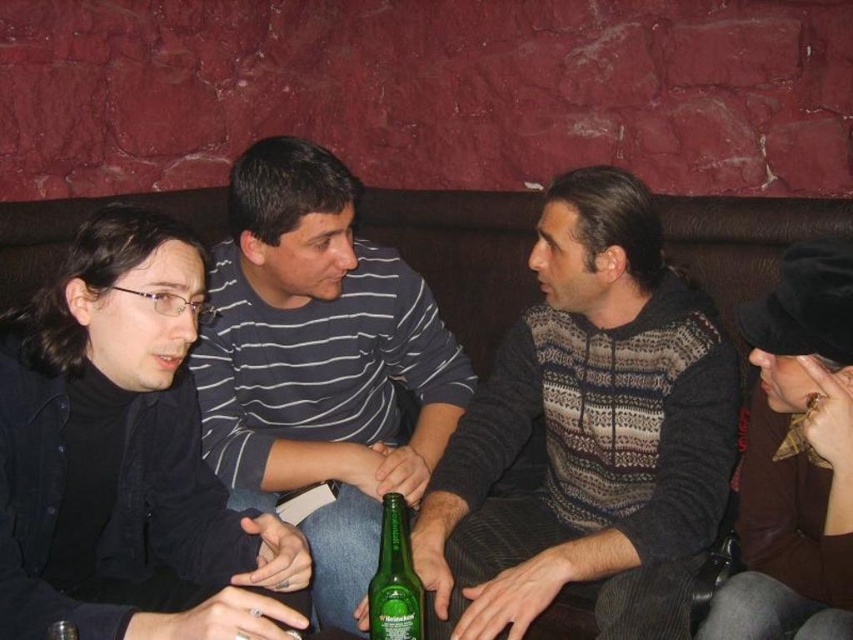
Question: Among these points, which one is nearest to the camera?

Choices:
 (A) (30, 540)
 (B) (447, 356)

Answer: (A)

Question: Which of the following is the closest to the observer?

Choices:
 (A) green glass bottle at center
 (B) knitted sweater at center

Answer: (A)

Question: Does striped cotton shirt at center appear on the left side of brown knitted hat at upper right?

Choices:
 (A) yes
 (B) no

Answer: (A)

Question: Which of the following is the closest to the observer?

Choices:
 (A) (809, 276)
 (B) (262, 420)
 (C) (173, 464)

Answer: (A)

Question: Does knitted sweater at center appear under brown knitted hat at upper right?

Choices:
 (A) yes
 (B) no

Answer: (B)

Question: In this image, where is black matte jacket at left located relative to brown knitted hat at upper right?

Choices:
 (A) below
 (B) above

Answer: (B)